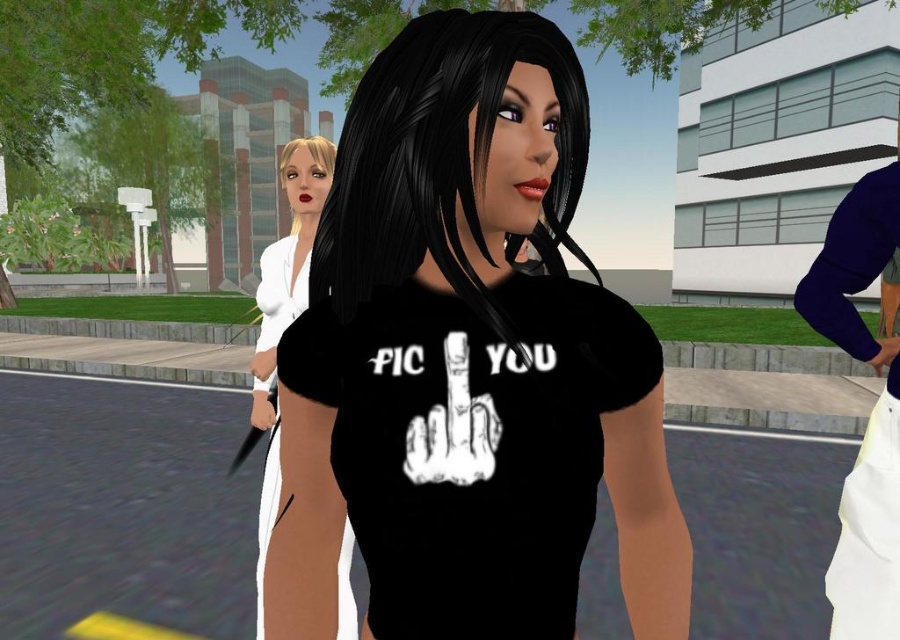
Question: Which of the following is the closest to the observer?

Choices:
 (A) (507, 413)
 (B) (324, 198)
 (C) (306, 145)

Answer: (A)

Question: Is black matte t-shirt at center below white matte dress at center?

Choices:
 (A) yes
 (B) no

Answer: (B)

Question: Which point appears closest to the camera in this image?

Choices:
 (A) (839, 332)
 (B) (469, 182)
 (C) (369, 296)
 (D) (316, 145)

Answer: (B)

Question: Does black matte hair at center lie in front of white matte dress at center?

Choices:
 (A) no
 (B) yes

Answer: (B)

Question: Considering the real-world distances, which object is closest to the white matte dress at center?

Choices:
 (A) black matte hair at center
 (B) blondehair at center
 (C) dark blue fabric at right

Answer: (B)

Question: Does black matte hair at center lie behind dark blue fabric at right?

Choices:
 (A) no
 (B) yes

Answer: (A)